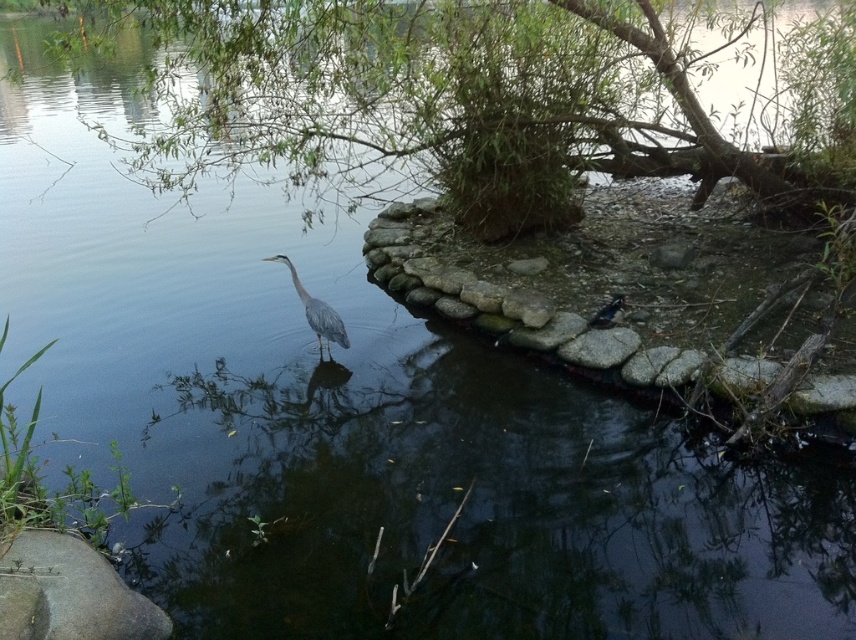
You are standing on the rocky shoreline to the right of the gray matte bird at center and want to look at the green leafy tree at upper center. In which direction should you turn your head?

The green leafy tree at upper center is positioned over the gray matte bird at center, so you should look upward to see the green leafy tree at upper center.

You are standing at the edge of the water and want to take a photo of the green leafy tree at upper center. If your camera has a maximum zoom range of 3 meters, will you need to zoom in to capture the tree clearly?

The green leafy tree at upper center is 3.78 meters from the viewer. Since the camera can only zoom up to 3 meters, you will need to zoom in beyond its maximum range to capture the tree clearly.